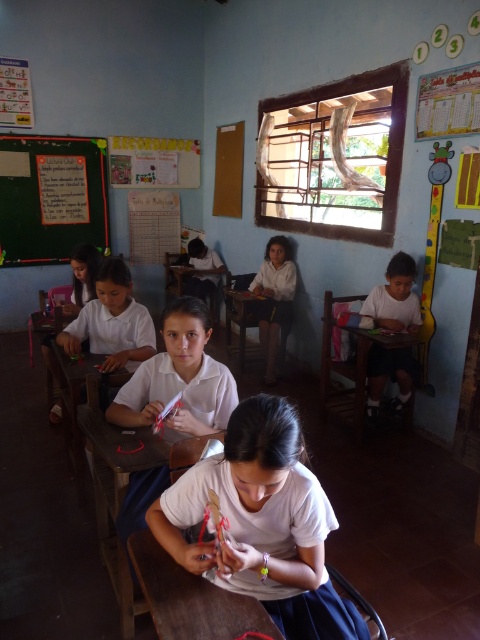
You are a teacher in the classroom looking at the white matte shirt at right and the wooden table at center. Which object is positioned further to the right side of the classroom?

The white matte shirt at right is positioned further to the right side of the classroom than the wooden table at center.